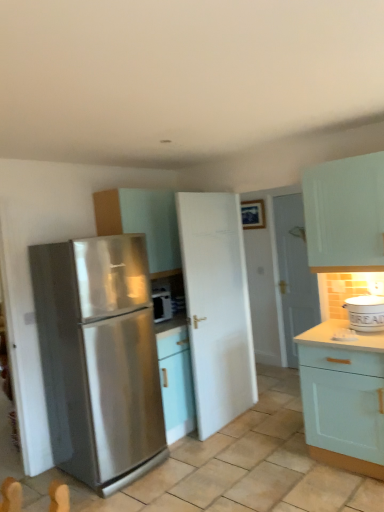
Locate an element on the screen. vacant space situated on the left part of light teal wood cabinet at lower right, which is the second cabinetry in left-to-right order is located at coordinates (281, 467).